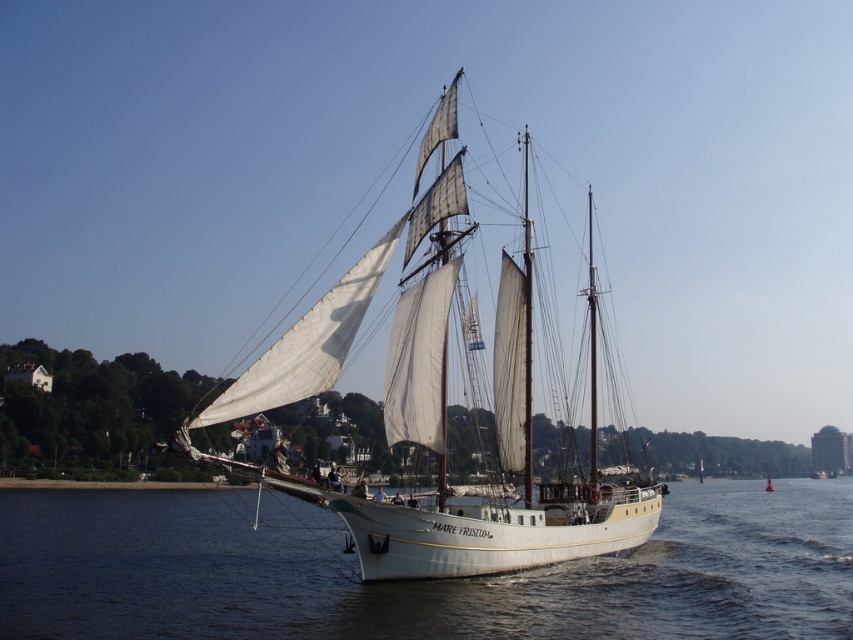
Question: Where is white water at center located in relation to white canvas sailboat at center in the image?

Choices:
 (A) right
 (B) left

Answer: (B)

Question: Can you confirm if white water at center is positioned to the left of white canvas sailboat at center?

Choices:
 (A) no
 (B) yes

Answer: (B)

Question: Among these points, which one is nearest to the camera?

Choices:
 (A) (428, 220)
 (B) (741, 540)

Answer: (A)

Question: Does white water at center come behind white canvas sailboat at center?

Choices:
 (A) no
 (B) yes

Answer: (B)

Question: Which object is closer to the camera taking this photo?

Choices:
 (A) white water at center
 (B) white canvas sailboat at center

Answer: (B)

Question: Which point is closer to the camera?

Choices:
 (A) white water at center
 (B) white canvas sailboat at center

Answer: (B)